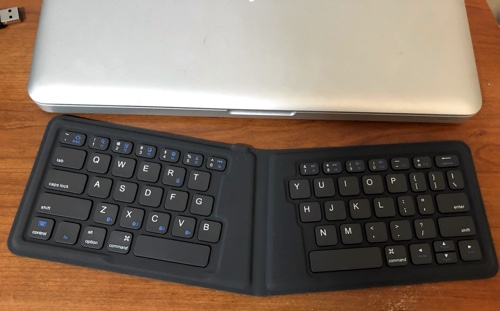
In order to click on keyboard in this screenshot , I will do `click(253, 229)`.